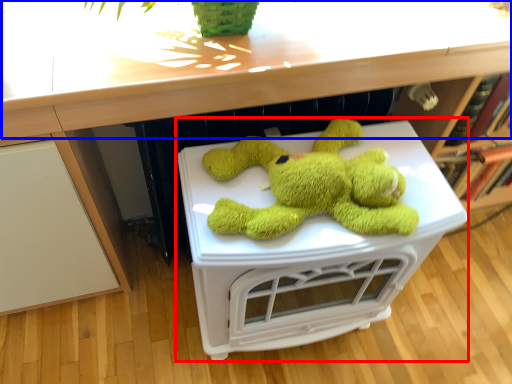
Question: Which object appears farthest to the camera in this image, table (highlighted by a red box) or counter top (highlighted by a blue box)?

Choices:
 (A) table
 (B) counter top

Answer: (A)